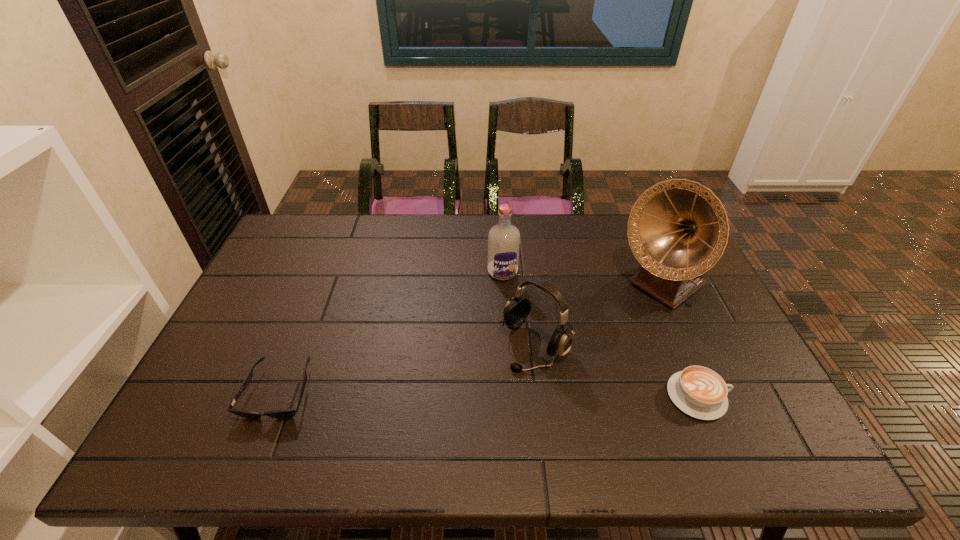
The height and width of the screenshot is (540, 960). Find the location of `object that is at the near right corner`. object that is at the near right corner is located at coordinates click(x=698, y=391).

I want to click on free space at the far edge of the desktop, so click(411, 222).

The height and width of the screenshot is (540, 960). In order to click on vacant region at the left edge in this screenshot , I will do `click(265, 274)`.

In the image, there is a desktop. Identify the location of free space at the right edge. This screenshot has height=540, width=960. (724, 342).

The width and height of the screenshot is (960, 540). I want to click on vacant region at the far left corner of the desktop, so click(x=335, y=214).

In the image, there is a desktop. Where is `free space at the near right corner`? The width and height of the screenshot is (960, 540). free space at the near right corner is located at coordinates (732, 408).

Where is `unoccupied area between the phonograph record and the sunglasses`? The image size is (960, 540). unoccupied area between the phonograph record and the sunglasses is located at coordinates (471, 340).

The width and height of the screenshot is (960, 540). I want to click on vacant space in between the cappuccino and the tallest object, so click(x=681, y=342).

In order to click on empty space that is in between the cappuccino and the tallest object in this screenshot , I will do `click(681, 342)`.

I want to click on empty location between the third shortest object and the leftmost object, so click(407, 368).